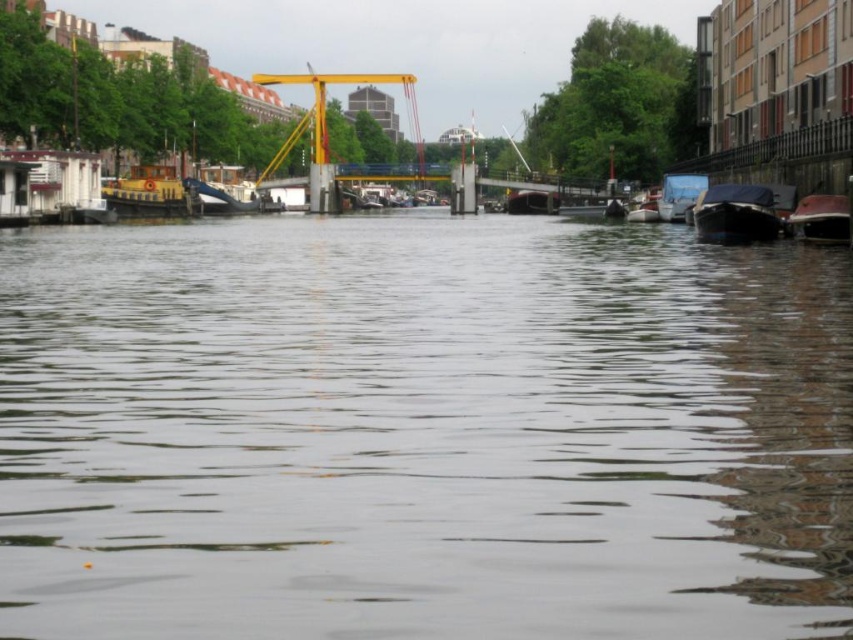
You are standing on the bank of the canal and want to know the exact position of the transparent water at center. What are its coordinates?

The transparent water at center is located at coordinates point [422,429].

You are a tour guide explaining the canal scene to visitors. You mention the transparent water at center and the metallic silver boat at center. How far apart are these two elements in the scene?

The transparent water at center and the metallic silver boat at center are 55.54 meters apart from each other.

You are a photographer standing at the edge of the canal. You want to take a photo that includes both the point at coordinates point (x=756, y=547) and point (x=699, y=211). Which point should you focus on first to ensure both are in sharp focus?

You should focus on point (x=699, y=211) first because it is farther from the camera, ensuring that both points will be in focus when using a depth of field that includes both distances.